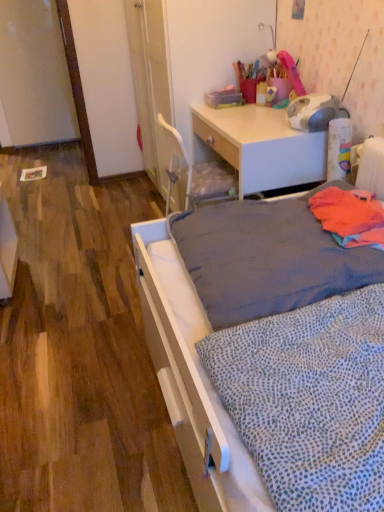
Question: Does orange fabric at right, which is counted as the first blanket, starting from the top, have a lesser width compared to white glossy desk at upper center?

Choices:
 (A) no
 (B) yes

Answer: (B)

Question: Can you confirm if orange fabric at right, arranged as the 2th blanket when ordered from the bottom, is shorter than white glossy desk at upper center?

Choices:
 (A) no
 (B) yes

Answer: (B)

Question: From the image's perspective, does orange fabric at right, which is counted as the first blanket, starting from the top, appear higher than white glossy desk at upper center?

Choices:
 (A) yes
 (B) no

Answer: (B)

Question: Considering the relative sizes of orange fabric at right, marked as the first blanket in a back-to-front arrangement, and white glossy desk at upper center in the image provided, is orange fabric at right, marked as the first blanket in a back-to-front arrangement, bigger than white glossy desk at upper center?

Choices:
 (A) no
 (B) yes

Answer: (A)

Question: Is the surface of orange fabric at right, the second blanket from the front, in direct contact with white glossy desk at upper center?

Choices:
 (A) yes
 (B) no

Answer: (B)

Question: Does orange fabric at right, which is counted as the first blanket, starting from the top, contain white glossy desk at upper center?

Choices:
 (A) yes
 (B) no

Answer: (B)

Question: Is white glossy desk at upper center located outside gray fabric mattress at center?

Choices:
 (A) yes
 (B) no

Answer: (A)

Question: Is white glossy desk at upper center directly adjacent to gray fabric mattress at center?

Choices:
 (A) yes
 (B) no

Answer: (B)

Question: Can you confirm if white glossy desk at upper center is positioned to the left of gray fabric mattress at center?

Choices:
 (A) no
 (B) yes

Answer: (A)

Question: From the image's perspective, is white glossy desk at upper center under gray fabric mattress at center?

Choices:
 (A) no
 (B) yes

Answer: (A)

Question: From a real-world perspective, is white glossy desk at upper center over gray fabric mattress at center?

Choices:
 (A) no
 (B) yes

Answer: (A)

Question: Does white glossy desk at upper center have a lesser width compared to gray fabric mattress at center?

Choices:
 (A) yes
 (B) no

Answer: (A)

Question: Is the position of white dotted fabric at lower right, the 2th blanket viewed from the back, more distant than that of orange fabric at right, the second blanket from the front?

Choices:
 (A) no
 (B) yes

Answer: (A)